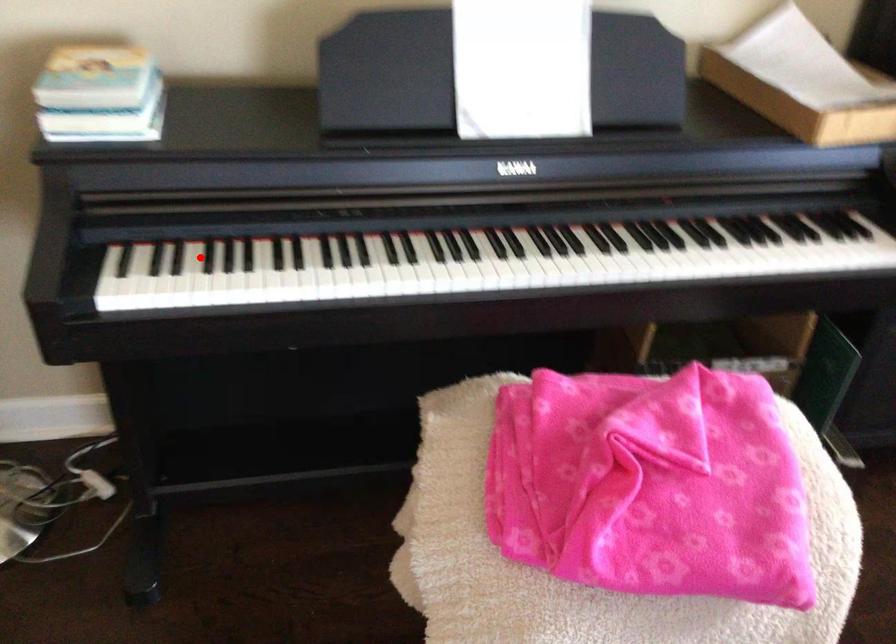
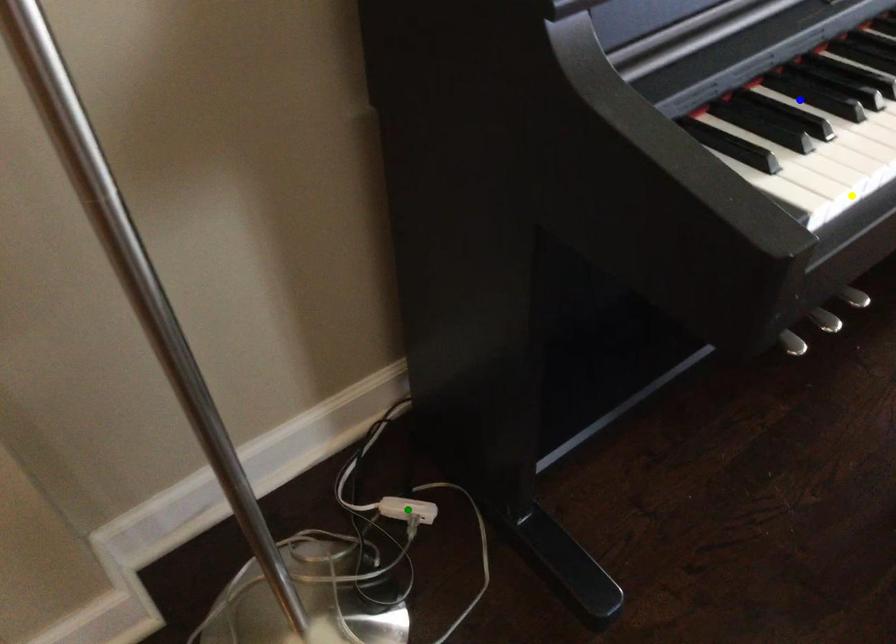
Question: I am providing you with two images of the same scene from different viewpoints. A red point is marked on the first image. You are given multiple points on the second image. Which point in image 2 represents the same 3d spot as the red point in image 1?

Choices:
 (A) green point
 (B) blue point
 (C) yellow point

Answer: (B)